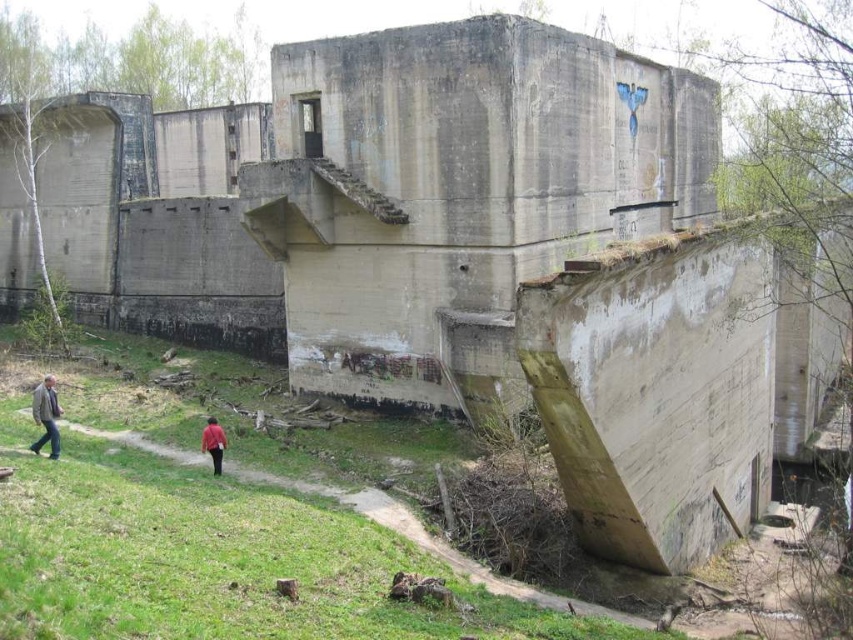
Question: Can you confirm if light brown leather jacket at lower left is positioned above red matte shirt at lower center?

Choices:
 (A) yes
 (B) no

Answer: (A)

Question: Which point is farther from the camera taking this photo?

Choices:
 (A) (219, 456)
 (B) (54, 401)

Answer: (A)

Question: Among these objects, which one is farthest from the camera?

Choices:
 (A) red matte shirt at lower center
 (B) light brown leather jacket at lower left

Answer: (A)

Question: Can you confirm if light brown leather jacket at lower left is wider than red matte shirt at lower center?

Choices:
 (A) no
 (B) yes

Answer: (B)

Question: From the image, what is the correct spatial relationship of light brown leather jacket at lower left in relation to red matte shirt at lower center?

Choices:
 (A) above
 (B) below

Answer: (A)

Question: Which point is farther to the camera?

Choices:
 (A) light brown leather jacket at lower left
 (B) red matte shirt at lower center

Answer: (B)